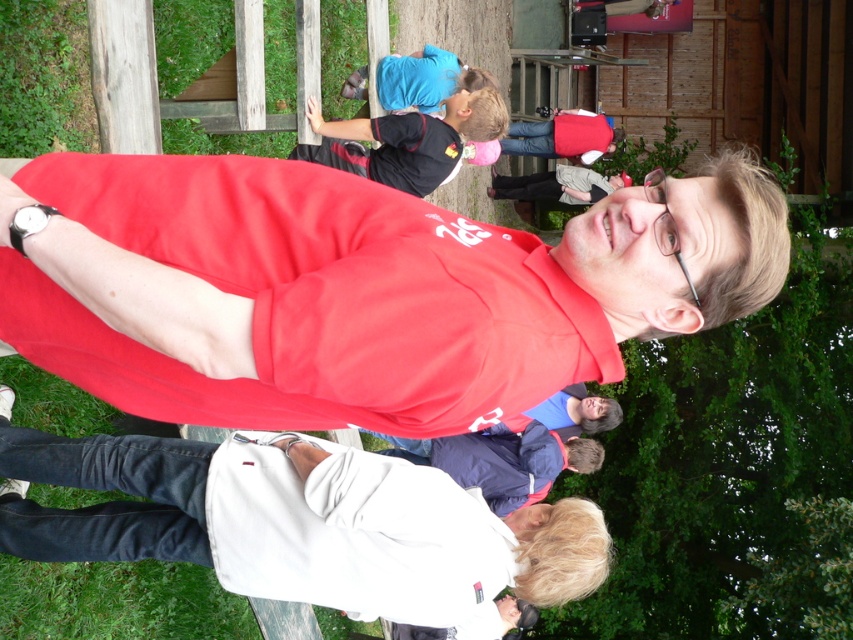
Question: Is matte red shirt at center further to the viewer compared to white matte jacket at center?

Choices:
 (A) no
 (B) yes

Answer: (A)

Question: Observing the image, what is the correct spatial positioning of white matte jacket at center in reference to black jersey at upper center?

Choices:
 (A) below
 (B) above

Answer: (A)

Question: Among these points, which one is nearest to the camera?

Choices:
 (A) (234, 476)
 (B) (432, 124)

Answer: (A)

Question: Which object is farther from the camera taking this photo?

Choices:
 (A) black jersey at upper center
 (B) matte red shirt at center
 (C) white matte jacket at center

Answer: (A)

Question: Among these points, which one is farthest from the camera?

Choices:
 (A) (525, 278)
 (B) (334, 598)
 (C) (440, 177)

Answer: (C)

Question: Is matte red shirt at center smaller than black jersey at upper center?

Choices:
 (A) yes
 (B) no

Answer: (A)